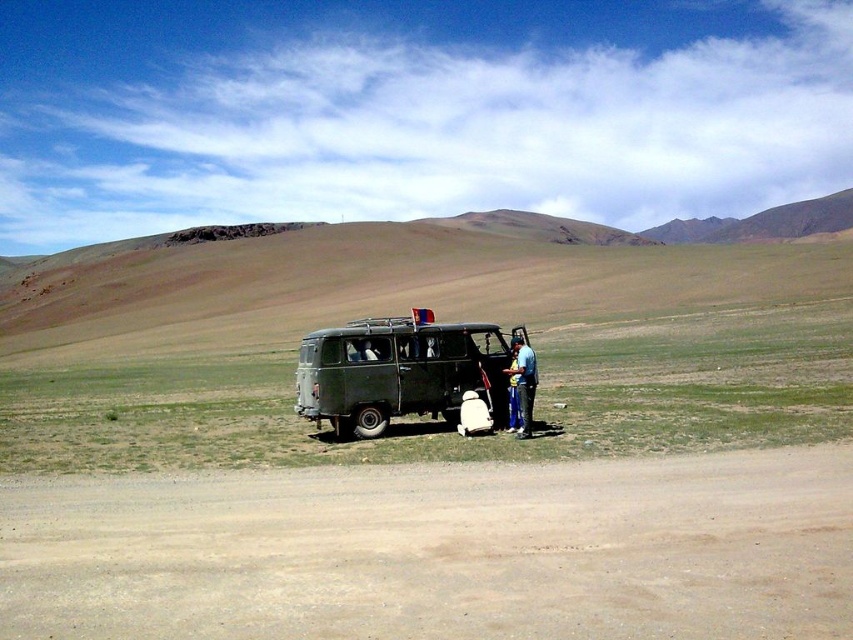
Is point (657, 460) more distant than point (445, 412)?

That is False.

Is brown sandy dirt at lower center above matte green van at center?

Actually, brown sandy dirt at lower center is below matte green van at center.

Is point (503, 499) positioned before point (372, 356)?

Yes.

The image size is (853, 640). In order to click on brown sandy dirt at lower center in this screenshot , I will do point(438,552).

What do you see at coordinates (398, 372) in the screenshot? This screenshot has height=640, width=853. I see `matte green van at center` at bounding box center [398, 372].

Is matte green van at center wider than blue fabric bag at center?

Yes, matte green van at center is wider than blue fabric bag at center.

Between point (320, 417) and point (523, 396), which one is positioned in front?

Positioned in front is point (523, 396).

This screenshot has height=640, width=853. I want to click on matte green van at center, so click(x=398, y=372).

Measure the distance between brown sandy dirt at lower center and camera.

brown sandy dirt at lower center and camera are 6.77 meters apart from each other.

How much distance is there between brown sandy dirt at lower center and blue fabric bag at center?

brown sandy dirt at lower center is 7.21 meters from blue fabric bag at center.

What are the coordinates of `brown sandy dirt at lower center` in the screenshot? It's located at (438, 552).